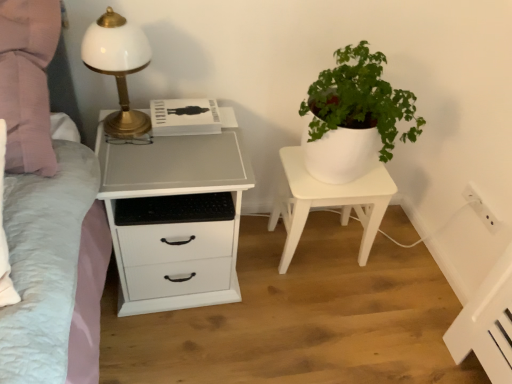
Where is `free space to the right of white matte plant pot at center`? The width and height of the screenshot is (512, 384). free space to the right of white matte plant pot at center is located at coordinates (400, 262).